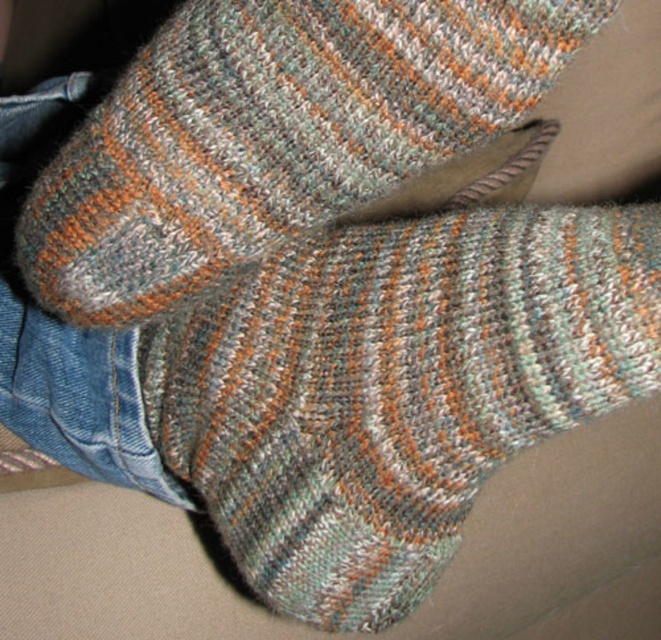
You are trying to put on the multicolored knitted socks. You see the multicolored knitted sock at lower center and the multicolored knitted sock at center. Which sock should you put on your foot first based on their positions?

You should put on the multicolored knitted sock at lower center first because it is closer to you than the multicolored knitted sock at center, which is further away.

You are trying to put on the multicolored knitted sock at lower center and the multicolored knitted sock at center. Which sock should you put on first if you want to wear the wider one first?

The multicolored knitted sock at lower center might be wider than multicolored knitted sock at center, so you should put on the multicolored knitted sock at lower center first.

Consider the image. You are taking a photo of the socks and notice two points marked on the image. The points are labeled as point 1 at coordinate point (477, 484) and point 2 at coordinate point (327, 196). If you want to focus on the point that is closer to the camera, which point should you choose?

Point 2 at coordinate point (327, 196) is closer to the camera than point 1 at coordinate point (477, 484), so you should choose point 2.